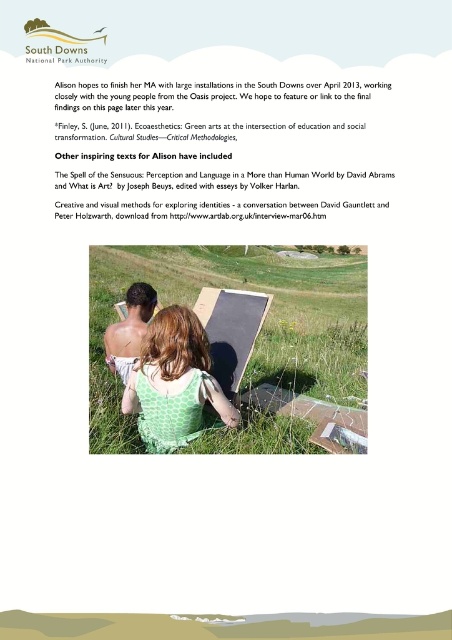
You are a photographer who wants to capture the green grass at center and the white paper at upper center in a single shot. Which object will appear larger in the photo?

The green grass at center will appear larger in the photo because it is much taller than the white paper at upper center.

You are an artist visiting the South Downs National Park and see the green grass at center and the green dotted dress at center in the image. Which object is positioned higher in the visual field?

The green grass at center is located above the green dotted dress at center, so it is positioned higher in the visual field.

You are an artist looking at the image and want to locate the green dotted dress at center. What are the coordinates where you can find it?

The green dotted dress at center is located at coordinates point (174, 381).